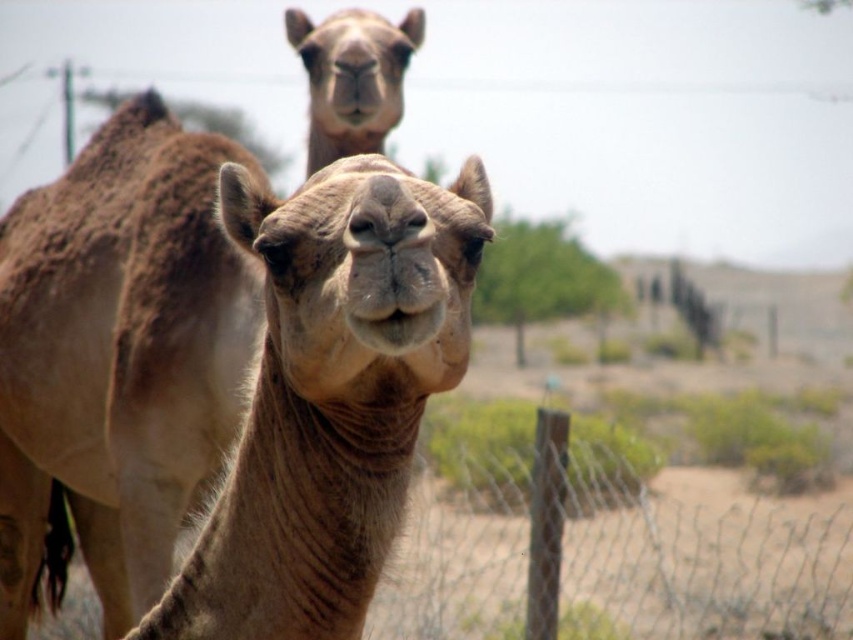
Question: Is brown textured camel at center to the left of wire mesh at lower right from the viewer's perspective?

Choices:
 (A) no
 (B) yes

Answer: (B)

Question: Is brown textured camel at center in front of wire mesh at lower right?

Choices:
 (A) no
 (B) yes

Answer: (B)

Question: Does brown textured camel at center appear on the right side of wire mesh at lower right?

Choices:
 (A) yes
 (B) no

Answer: (B)

Question: Which point is farther from the camera taking this photo?

Choices:
 (A) (442, 621)
 (B) (26, 300)

Answer: (A)